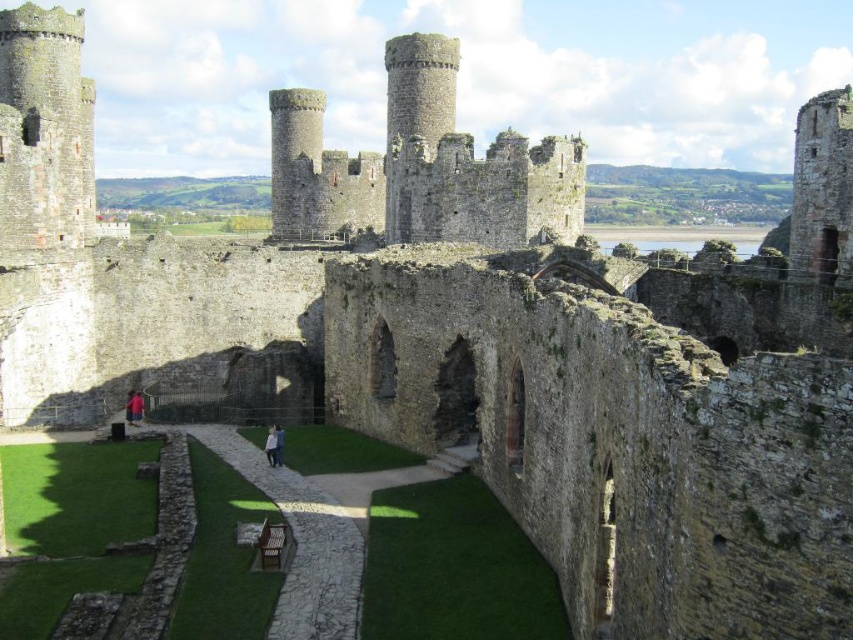
You are standing in front of the rustic stone castle at center. If you want to take a photo of the entire castle without moving your camera, would you need a wide angle lens?

The rustic stone castle at center is 89.62 meters from camera. Since it is quite far away, using a wide angle lens would help capture the entire structure in one frame.

You are standing in the courtyard of the castle and notice a light brown leather jacket at center and a rustic stone castle at center. Which object is positioned to the left?

The light brown leather jacket at center is to the left of rustic stone castle at center.